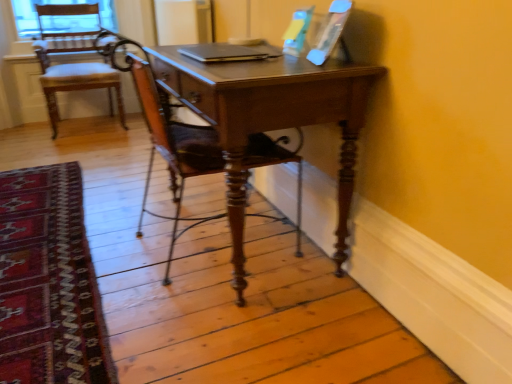
Image resolution: width=512 pixels, height=384 pixels. I want to click on free spot in front of wooden polished chair at center, the first chair viewed from the right, so click(x=221, y=328).